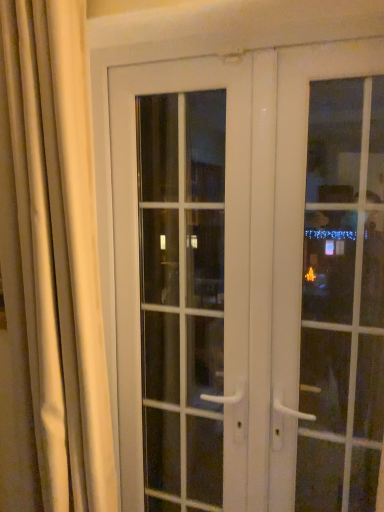
Question: Considering the relative sizes of white glossy door at center, the second door in the right-to-left sequence, and white glossy door at right, which is the first door in right-to-left order, in the image provided, is white glossy door at center, the second door in the right-to-left sequence, wider than white glossy door at right, which is the first door in right-to-left order,?

Choices:
 (A) no
 (B) yes

Answer: (A)

Question: Considering the relative positions of white glossy door at center, which is counted as the second door, starting from the left, and white glossy door at right, which is the first door in right-to-left order, in the image provided, is white glossy door at center, which is counted as the second door, starting from the left, behind white glossy door at right, which is the first door in right-to-left order,?

Choices:
 (A) yes
 (B) no

Answer: (A)

Question: Is white glossy door at center, the second door in the right-to-left sequence, at the right side of white glossy door at right, which is the first door in right-to-left order?

Choices:
 (A) yes
 (B) no

Answer: (B)

Question: Does white glossy door at center, which is counted as the second door, starting from the left, have a lesser height compared to white glossy door at right, which is the first door in right-to-left order?

Choices:
 (A) no
 (B) yes

Answer: (A)

Question: From a real-world perspective, is white glossy door at center, the second door in the right-to-left sequence, located higher than white glossy door at right, which is the first door in right-to-left order?

Choices:
 (A) no
 (B) yes

Answer: (A)

Question: Is white glossy door at center, which is counted as the second door, starting from the left, smaller than white glossy door at right, which is the first door in right-to-left order?

Choices:
 (A) no
 (B) yes

Answer: (A)

Question: Is silky beige curtain at left oriented towards white glass door at center, which is counted as the 3th door, starting from the right?

Choices:
 (A) no
 (B) yes

Answer: (A)

Question: Can you confirm if silky beige curtain at left is thinner than white glass door at center, which is counted as the 3th door, starting from the right?

Choices:
 (A) no
 (B) yes

Answer: (A)

Question: Does silky beige curtain at left have a greater width compared to white glass door at center, acting as the first door starting from the left?

Choices:
 (A) yes
 (B) no

Answer: (A)

Question: Is silky beige curtain at left in contact with white glass door at center, which is counted as the 3th door, starting from the right?

Choices:
 (A) yes
 (B) no

Answer: (B)

Question: Is silky beige curtain at left further to camera compared to white glass door at center, acting as the first door starting from the left?

Choices:
 (A) yes
 (B) no

Answer: (B)

Question: Is silky beige curtain at left outside of white glass door at center, acting as the first door starting from the left?

Choices:
 (A) yes
 (B) no

Answer: (A)

Question: Does white glossy door at right, which is the first door in right-to-left order, come behind silky beige curtain at left?

Choices:
 (A) no
 (B) yes

Answer: (B)